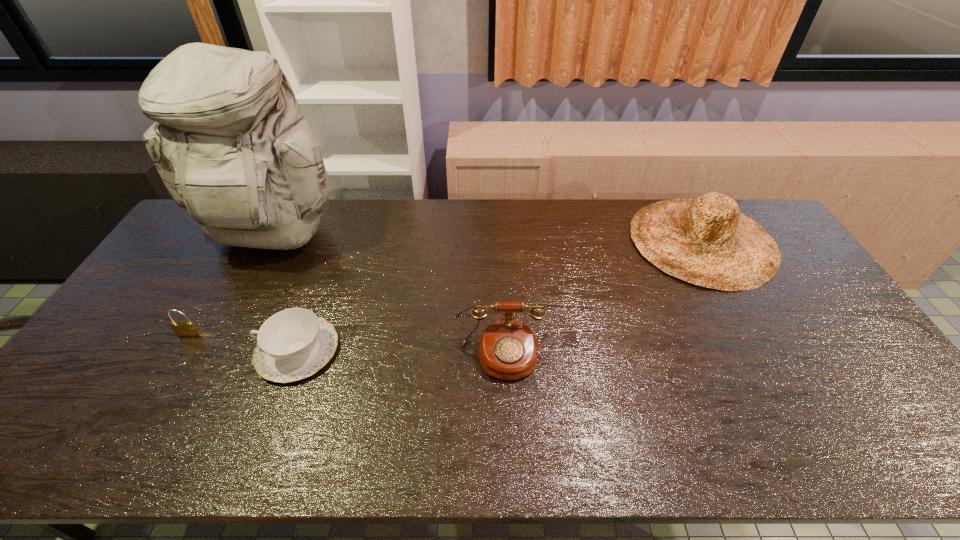
In order to click on vacant space at the left edge of the desktop in this screenshot , I will do `click(171, 269)`.

The width and height of the screenshot is (960, 540). Find the location of `vacant space at the far right corner`. vacant space at the far right corner is located at coordinates (754, 210).

Locate an element on the screen. Image resolution: width=960 pixels, height=540 pixels. vacant space at the near right corner of the desktop is located at coordinates (871, 436).

The image size is (960, 540). Identify the location of blank region between the telephone and the rightmost object. (601, 298).

At what (x,y) coordinates should I click in order to perform the action: click on free space between the backpack and the rightmost object. Please return your answer as a coordinate pair (x, y). This screenshot has height=540, width=960. Looking at the image, I should click on click(x=487, y=239).

Find the location of a particular element. This screenshot has width=960, height=540. free spot between the shortest object and the sunhat is located at coordinates (500, 295).

Where is `vacant area between the second shortest object and the chinaware`? This screenshot has width=960, height=540. vacant area between the second shortest object and the chinaware is located at coordinates (244, 342).

The image size is (960, 540). Identify the location of free point between the second shortest object and the telephone. (345, 345).

The image size is (960, 540). I want to click on empty space that is in between the second object from right to left and the sunhat, so click(601, 298).

Where is `vacant point located between the tallest object and the rightmost object`? The height and width of the screenshot is (540, 960). vacant point located between the tallest object and the rightmost object is located at coordinates (487, 239).